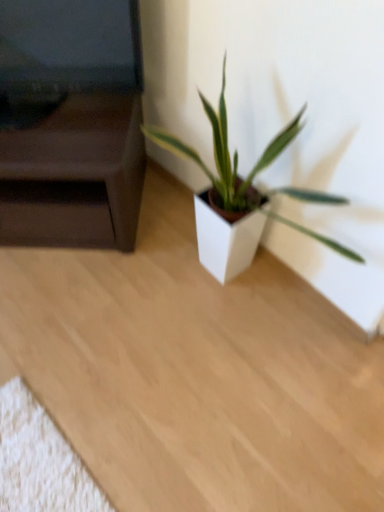
The height and width of the screenshot is (512, 384). In order to click on free location in front of white matte planter at center in this screenshot , I will do `click(236, 414)`.